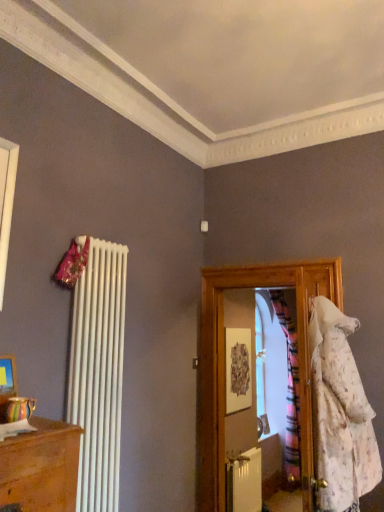
Question: Should I look upward or downward to see white matte radiator at lower left?

Choices:
 (A) down
 (B) up

Answer: (A)